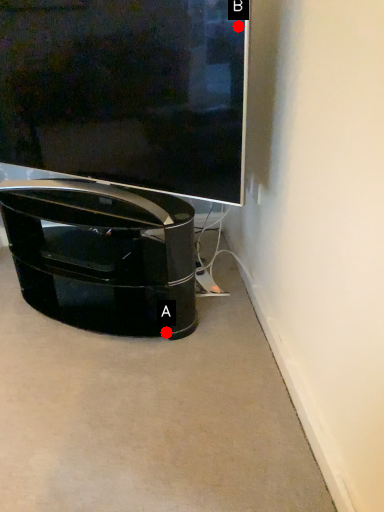
Question: Two points are circled on the image, labeled by A and B beside each circle. Among these points, which one is farthest from the camera?

Choices:
 (A) A is further
 (B) B is further

Answer: (A)